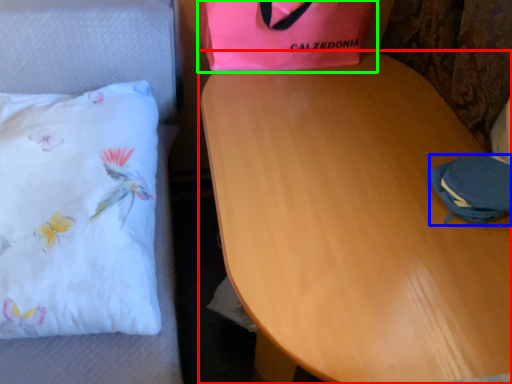
Question: Considering the real-world distances, which object is closest to table (highlighted by a red box)? pouch (highlighted by a blue box) or gift bag (highlighted by a green box).

Choices:
 (A) pouch
 (B) gift bag

Answer: (A)